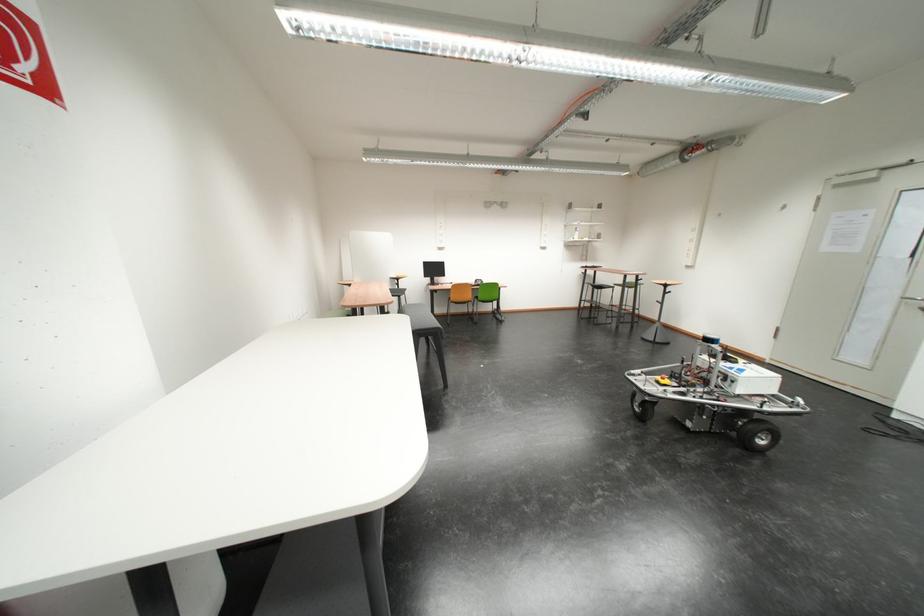
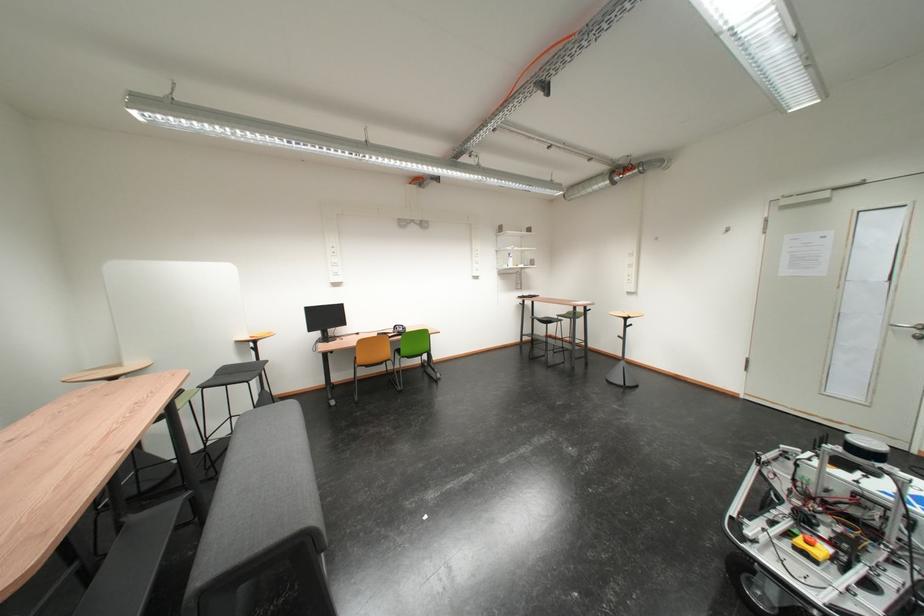
The point at (663, 284) is marked in the first image. Where is the corresponding point in the second image?

(622, 315)